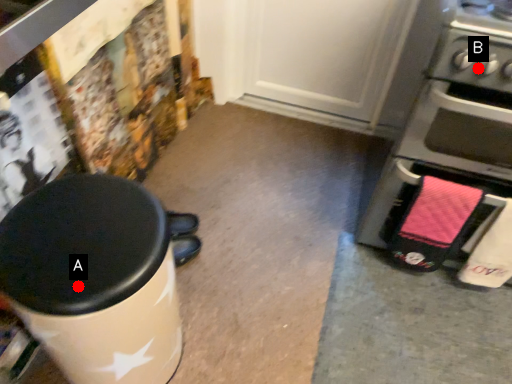
Question: Two points are circled on the image, labeled by A and B beside each circle. Which point is farther from the camera taking this photo?

Choices:
 (A) A is further
 (B) B is further

Answer: (B)